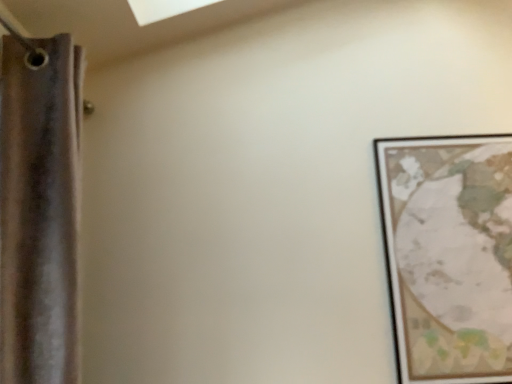
Question: Does wooden framed map at right have a smaller size compared to brown fabric curtain at left?

Choices:
 (A) no
 (B) yes

Answer: (B)

Question: Are wooden framed map at right and brown fabric curtain at left located far from each other?

Choices:
 (A) yes
 (B) no

Answer: (A)

Question: Considering the relative sizes of wooden framed map at right and brown fabric curtain at left in the image provided, is wooden framed map at right taller than brown fabric curtain at left?

Choices:
 (A) no
 (B) yes

Answer: (A)

Question: Considering the relative sizes of wooden framed map at right and brown fabric curtain at left in the image provided, is wooden framed map at right bigger than brown fabric curtain at left?

Choices:
 (A) no
 (B) yes

Answer: (A)

Question: From a real-world perspective, is wooden framed map at right located beneath brown fabric curtain at left?

Choices:
 (A) no
 (B) yes

Answer: (B)

Question: From a real-world perspective, is wooden framed map at right positioned over brown fabric curtain at left based on gravity?

Choices:
 (A) no
 (B) yes

Answer: (A)

Question: From the image's perspective, does brown fabric curtain at left appear lower than wooden framed map at right?

Choices:
 (A) yes
 (B) no

Answer: (B)

Question: Does brown fabric curtain at left have a greater height compared to wooden framed map at right?

Choices:
 (A) no
 (B) yes

Answer: (B)

Question: Is brown fabric curtain at left closer to the viewer compared to wooden framed map at right?

Choices:
 (A) yes
 (B) no

Answer: (A)

Question: Could you tell me if brown fabric curtain at left is turned towards wooden framed map at right?

Choices:
 (A) yes
 (B) no

Answer: (A)

Question: Is brown fabric curtain at left bigger than wooden framed map at right?

Choices:
 (A) yes
 (B) no

Answer: (A)

Question: Considering the relative sizes of brown fabric curtain at left and wooden framed map at right in the image provided, is brown fabric curtain at left wider than wooden framed map at right?

Choices:
 (A) yes
 (B) no

Answer: (A)

Question: Is wooden framed map at right wider or thinner than brown fabric curtain at left?

Choices:
 (A) thin
 (B) wide

Answer: (A)